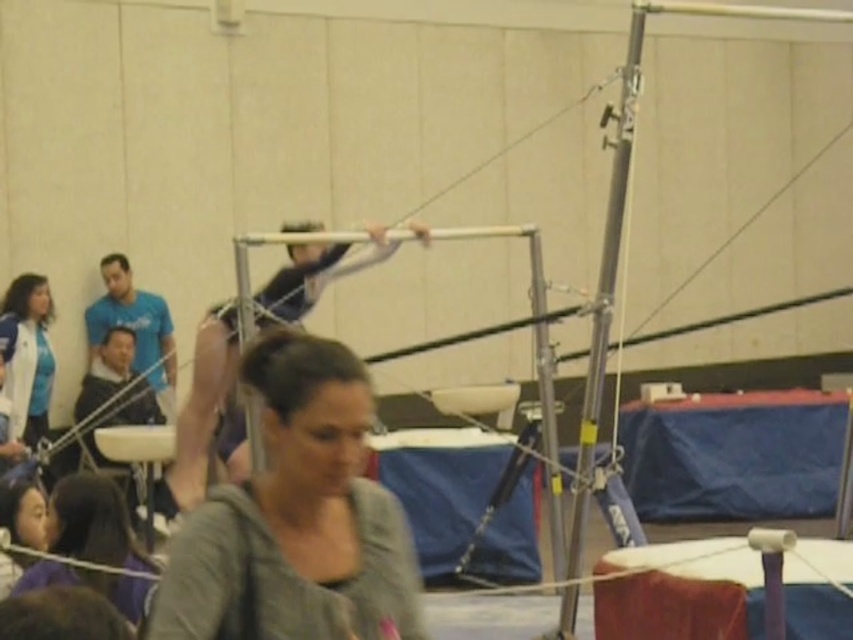
Can you confirm if gray matte jacket at center is smaller than smooth purple mat at center?

Yes.

Which is more to the right, gray matte jacket at center or smooth purple mat at center?

smooth purple mat at center is more to the right.

Who is more distant from viewer, (344,355) or (601,625)?

The point (601,625) is more distant.

Identify the location of gray matte jacket at center. The width and height of the screenshot is (853, 640). (296, 518).

Is gray matte jacket at center shorter than white jacket at left?

Correct, gray matte jacket at center is not as tall as white jacket at left.

Image resolution: width=853 pixels, height=640 pixels. I want to click on gray matte jacket at center, so click(x=296, y=518).

Where is `gray matte jacket at center`? The height and width of the screenshot is (640, 853). gray matte jacket at center is located at coordinates (296, 518).

Which is more to the right, matte purple shirt at lower left or white jacket at left?

matte purple shirt at lower left is more to the right.

What do you see at coordinates (91, 522) in the screenshot? I see `matte purple shirt at lower left` at bounding box center [91, 522].

Find the location of `matte purple shirt at lower left`. matte purple shirt at lower left is located at coordinates (91, 522).